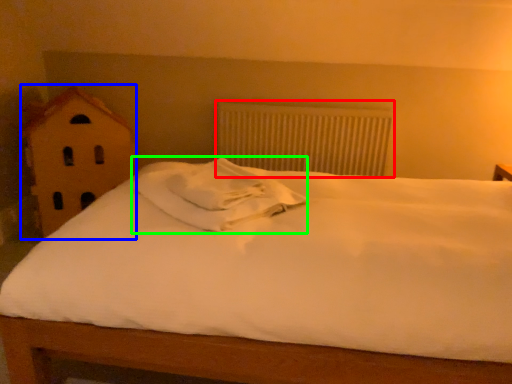
Question: Considering the real-world distances, which object is farthest from radiator (highlighted by a red box)? toy (highlighted by a blue box) or pillow (highlighted by a green box)?

Choices:
 (A) toy
 (B) pillow

Answer: (B)